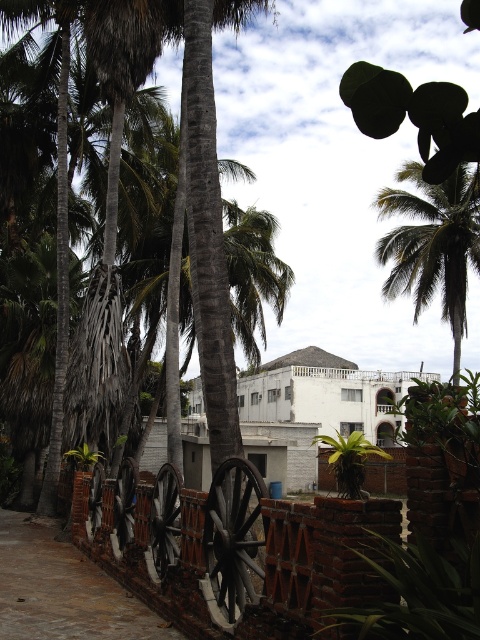
Question: Considering the relative positions of rustic wood wagon at center and green leafy palm tree at upper right in the image provided, where is rustic wood wagon at center located with respect to green leafy palm tree at upper right?

Choices:
 (A) right
 (B) left

Answer: (B)

Question: Observing the image, what is the correct spatial positioning of rustic wood wagon at center in reference to brick wall at center?

Choices:
 (A) above
 (B) below

Answer: (A)

Question: Based on their relative distances, which object is farther from the green leafy palm tree at upper right?

Choices:
 (A) wooden wheels at lower center
 (B) brick wall at center
 (C) rustic wood wagon at center

Answer: (C)

Question: Among these points, which one is farthest from the camera?

Choices:
 (A) (40, 596)
 (B) (231, 506)
 (C) (446, 198)

Answer: (C)

Question: Which point is closer to the camera taking this photo?

Choices:
 (A) (332, 468)
 (B) (245, 592)
 (C) (410, 276)
 (D) (12, 584)

Answer: (B)

Question: Does wooden wheels at lower center come behind green leafy palm tree at upper right?

Choices:
 (A) yes
 (B) no

Answer: (B)